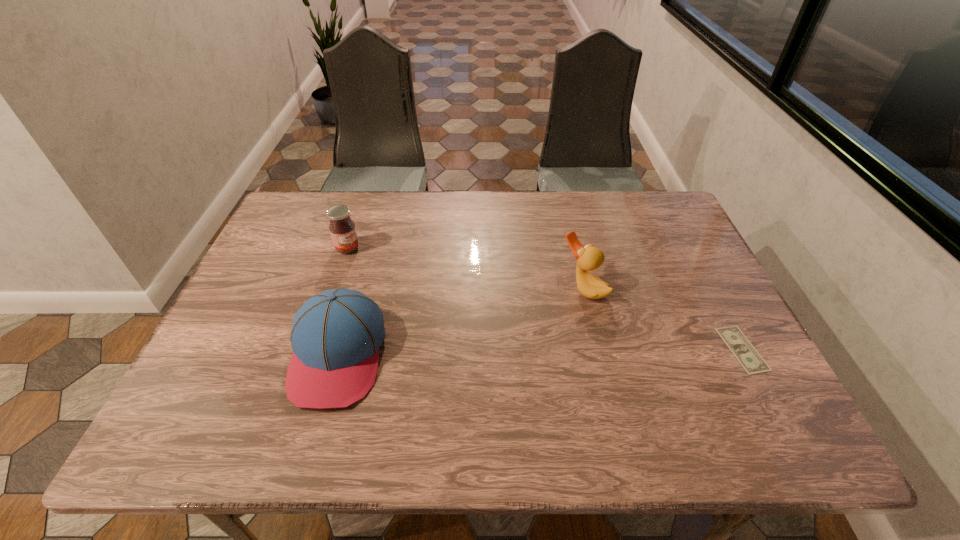
Locate an element on the screen. baseball cap is located at coordinates (336, 335).

Locate an element on the screen. The width and height of the screenshot is (960, 540). the shortest object is located at coordinates (748, 357).

This screenshot has height=540, width=960. Find the location of `the rightmost object`. the rightmost object is located at coordinates (748, 357).

Locate an element on the screen. The height and width of the screenshot is (540, 960). the farthest object is located at coordinates (342, 228).

Where is `the second farthest object`? the second farthest object is located at coordinates pos(589,258).

This screenshot has width=960, height=540. In order to click on the third object from left to right in this screenshot , I will do `click(589, 258)`.

Locate an element on the screen. blank area located 0.360m on the back of the money is located at coordinates (682, 233).

The height and width of the screenshot is (540, 960). Identify the location of vacant space located 0.080m on the label side of the farthest object. (374, 265).

Locate an element on the screen. vacant space situated 0.150m on the label side of the farthest object is located at coordinates (393, 275).

Image resolution: width=960 pixels, height=540 pixels. What are the coordinates of `blank area located on the label side of the farthest object` in the screenshot? It's located at (421, 294).